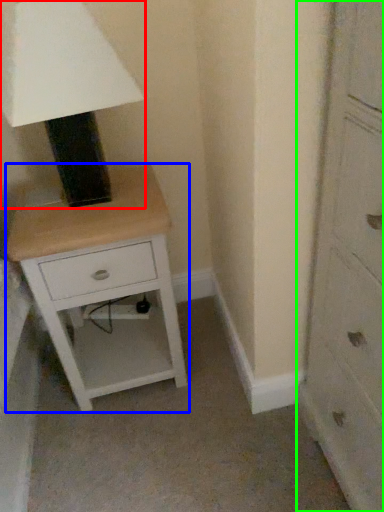
Question: Which is nearer to the table lamp (highlighted by a red box)? nightstand (highlighted by a blue box) or chest of drawers (highlighted by a green box).

Choices:
 (A) nightstand
 (B) chest of drawers

Answer: (A)